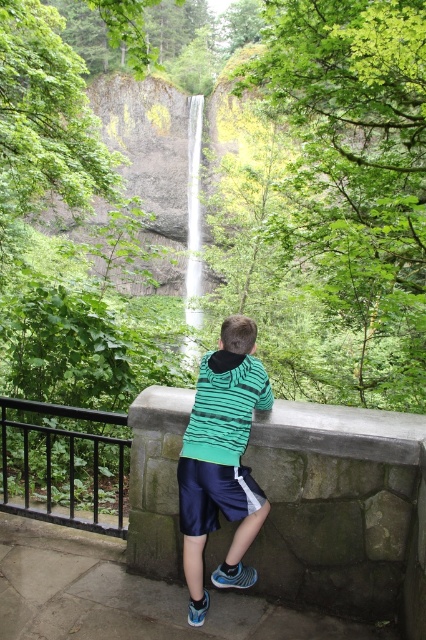
Question: Can you confirm if black metal railing at left is positioned above white smooth waterfall at center?

Choices:
 (A) yes
 (B) no

Answer: (B)

Question: Considering the real-world distances, which object is closest to the white smooth waterfall at center?

Choices:
 (A) black metal railing at left
 (B) green striped hoodie at center

Answer: (A)

Question: In this image, where is green striped hoodie at center located relative to black metal railing at left?

Choices:
 (A) left
 (B) right

Answer: (B)

Question: Is green striped hoodie at center to the left of black metal railing at left from the viewer's perspective?

Choices:
 (A) yes
 (B) no

Answer: (B)

Question: Estimate the real-world distances between objects in this image. Which object is closer to the green striped hoodie at center?

Choices:
 (A) white smooth waterfall at center
 (B) black metal railing at left

Answer: (B)

Question: Among these points, which one is farthest from the camera?

Choices:
 (A) (0, 422)
 (B) (192, 228)

Answer: (B)